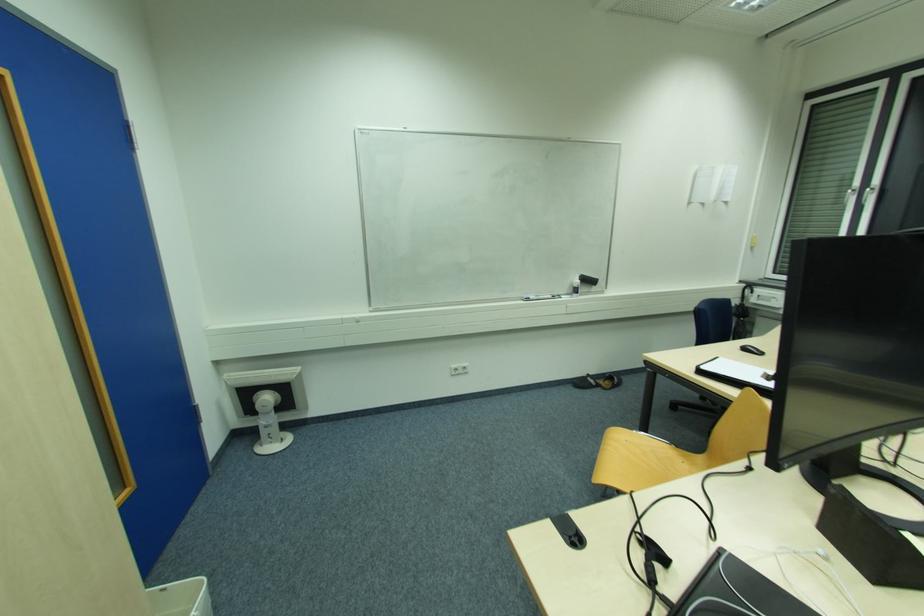
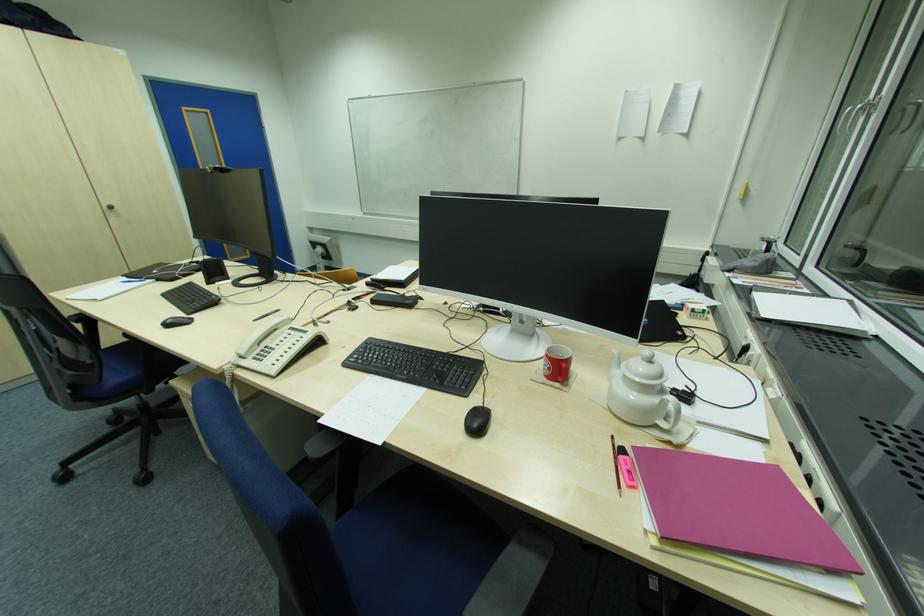
The point at (852, 191) is marked in the first image. Where is the corresponding point in the second image?

(850, 111)